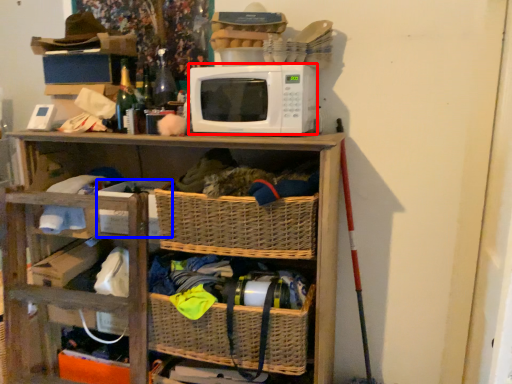
Question: Which of the following is the farthest to the observer, microwave oven (highlighted by a red box) or storage box (highlighted by a blue box)?

Choices:
 (A) microwave oven
 (B) storage box

Answer: (B)